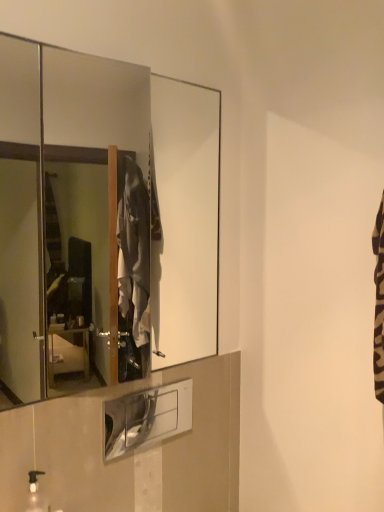
Find the location of a particular element. matte glass mirror at upper left is located at coordinates (103, 221).

The image size is (384, 512). Describe the element at coordinates (103, 221) in the screenshot. I see `matte glass mirror at upper left` at that location.

The width and height of the screenshot is (384, 512). Identify the location of matte glass mirror at upper left. (103, 221).